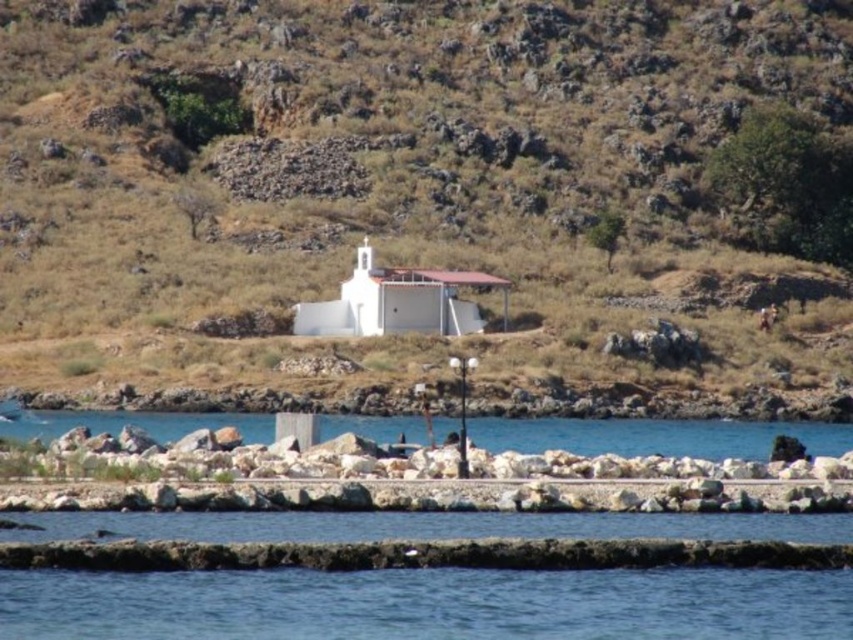
Question: Which point appears closest to the camera in this image?

Choices:
 (A) (392, 275)
 (B) (581, 449)
 (C) (223, 188)

Answer: (B)

Question: Can you confirm if clear blue water at lower center is positioned below white matte church at center?

Choices:
 (A) no
 (B) yes

Answer: (B)

Question: Observing the image, what is the correct spatial positioning of smooth rock hillside at center in reference to white matte church at center?

Choices:
 (A) below
 (B) above

Answer: (B)

Question: Is clear blue water at lower center bigger than white matte church at center?

Choices:
 (A) no
 (B) yes

Answer: (B)

Question: Considering the real-world distances, which object is closest to the white matte church at center?

Choices:
 (A) smooth rock hillside at center
 (B) clear blue water at lower center

Answer: (B)

Question: Which point is closer to the camera taking this photo?

Choices:
 (A) (656, 422)
 (B) (16, 221)
 (C) (405, 304)

Answer: (A)